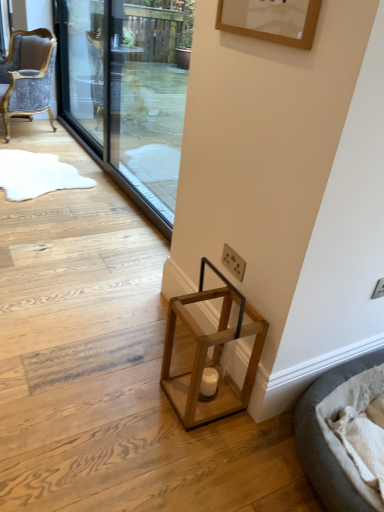
Where is `transparent glass screen door at upper left, the first screen door viewed from the left`? The image size is (384, 512). transparent glass screen door at upper left, the first screen door viewed from the left is located at coordinates (x=84, y=69).

At what (x,y) coordinates should I click in order to perform the action: click on velvet grey chair at left. Please return your answer as a coordinate pair (x, y). Image resolution: width=384 pixels, height=512 pixels. Looking at the image, I should click on pos(27,76).

From a real-world perspective, which object rests below the other?

wooden lantern at lower center.

Which of these two, wooden lantern at lower center or velvet grey chair at left, is wider?

velvet grey chair at left is wider.

Considering the relative sizes of wooden lantern at lower center and velvet grey chair at left in the image provided, is wooden lantern at lower center taller than velvet grey chair at left?

No, wooden lantern at lower center is not taller than velvet grey chair at left.

Is wooden lantern at lower center in contact with velvet grey chair at left?

No, wooden lantern at lower center is not touching velvet grey chair at left.

Based on their positions, is velvet grey chair at left located to the left or right of wooden lantern at lower center?

velvet grey chair at left is positioned on wooden lantern at lower center's left side.

In terms of height, does velvet grey chair at left look taller or shorter compared to wooden lantern at lower center?

In the image, velvet grey chair at left appears to be taller than wooden lantern at lower center.

From the image's perspective, is velvet grey chair at left above or below wooden lantern at lower center?

Clearly, from the image's perspective, velvet grey chair at left is above wooden lantern at lower center.

Between velvet grey chair at left and soft gray fabric cat bed at lower right, which one has smaller width?

With smaller width is velvet grey chair at left.

Is soft gray fabric cat bed at lower right at the back of velvet grey chair at left?

That's not correct — velvet grey chair at left is not looking away from soft gray fabric cat bed at lower right.

Is velvet grey chair at left far away from soft gray fabric cat bed at lower right?

Absolutely, velvet grey chair at left is distant from soft gray fabric cat bed at lower right.

Which is behind, velvet grey chair at left or soft gray fabric cat bed at lower right?

velvet grey chair at left is more distant.

At what (x,y) coordinates should I click in order to perform the action: click on cat bed on the right of wooden lantern at lower center. Please return your answer as a coordinate pair (x, y). The image size is (384, 512). Looking at the image, I should click on (325, 441).

Considering the points (183, 296) and (322, 399), which point is in front, point (183, 296) or point (322, 399)?

Point (322, 399)

From a real-world perspective, relative to soft gray fabric cat bed at lower right, is wooden lantern at lower center vertically above or below?

wooden lantern at lower center is below soft gray fabric cat bed at lower right.

From a real-world perspective, does velvet grey chair at left stand above transparent glass screen door at upper left, the first screen door viewed from the left?

No, from a real-world perspective, velvet grey chair at left is not on top of transparent glass screen door at upper left, the first screen door viewed from the left.

Is there a large distance between velvet grey chair at left and transparent glass screen door at upper left, which is the second screen door from right to left?

No, velvet grey chair at left is not far from transparent glass screen door at upper left, which is the second screen door from right to left.

Who is shorter, velvet grey chair at left or transparent glass screen door at upper left, the first screen door viewed from the left?

Standing shorter between the two is velvet grey chair at left.

Which is more to the left, transparent glass screen door at upper left, which is the second screen door from right to left, or velvet grey chair at left?

velvet grey chair at left is more to the left.

Can you confirm if transparent glass screen door at upper left, which is the second screen door from right to left, is bigger than velvet grey chair at left?

Incorrect, transparent glass screen door at upper left, which is the second screen door from right to left, is not larger than velvet grey chair at left.

Would you consider transparent glass screen door at upper left, the first screen door viewed from the left, to be distant from velvet grey chair at left?

Actually, transparent glass screen door at upper left, the first screen door viewed from the left, and velvet grey chair at left are a little close together.

From the image's perspective, would you say transparent glass screen door at upper center, positioned as the first screen door in right-to-left order, is positioned over transparent glass screen door at upper left, the first screen door viewed from the left?

No, from the image's perspective, transparent glass screen door at upper center, positioned as the first screen door in right-to-left order, is not on top of transparent glass screen door at upper left, the first screen door viewed from the left.

What's the angular difference between transparent glass screen door at upper center, which is counted as the 2th screen door, starting from the left, and transparent glass screen door at upper left, which is the second screen door from right to left,'s facing directions?

The angle between the facing direction of transparent glass screen door at upper center, which is counted as the 2th screen door, starting from the left, and the facing direction of transparent glass screen door at upper left, which is the second screen door from right to left, is 0.468 degrees.

Is transparent glass screen door at upper center, positioned as the first screen door in right-to-left order, at the left side of transparent glass screen door at upper left, the first screen door viewed from the left?

In fact, transparent glass screen door at upper center, positioned as the first screen door in right-to-left order, is to the right of transparent glass screen door at upper left, the first screen door viewed from the left.

Looking at this image, could transparent glass screen door at upper left, the first screen door viewed from the left, be considered to be inside transparent glass screen door at upper center, positioned as the first screen door in right-to-left order?

That's incorrect, transparent glass screen door at upper left, the first screen door viewed from the left, is not inside transparent glass screen door at upper center, positioned as the first screen door in right-to-left order.

In the image, there is a wooden lantern at lower center. Where is `chair above it (from the image's perspective)`? This screenshot has width=384, height=512. chair above it (from the image's perspective) is located at coordinates (27, 76).

This screenshot has width=384, height=512. I want to click on stool below the velvet grey chair at left (from a real-world perspective), so click(209, 359).

Which object lies nearer to the anchor point wooden lantern at lower center, velvet grey chair at left or transparent glass screen door at upper center, which is counted as the 2th screen door, starting from the left?

Based on the image, transparent glass screen door at upper center, which is counted as the 2th screen door, starting from the left, appears to be nearer to wooden lantern at lower center.

Considering their positions, is velvet grey chair at left positioned further to transparent glass screen door at upper left, which is the second screen door from right to left, than wooden lantern at lower center?

Among the two, wooden lantern at lower center is located further to transparent glass screen door at upper left, which is the second screen door from right to left.

When comparing their distances from velvet grey chair at left, does soft gray fabric cat bed at lower right or transparent glass screen door at upper left, the first screen door viewed from the left, seem further?

Among the two, soft gray fabric cat bed at lower right is located further to velvet grey chair at left.

Looking at the image, which one is located closer to velvet grey chair at left, wooden lantern at lower center or transparent glass screen door at upper center, positioned as the first screen door in right-to-left order?

transparent glass screen door at upper center, positioned as the first screen door in right-to-left order, lies closer to velvet grey chair at left than the other object.

From the image, which object appears to be nearer to transparent glass screen door at upper left, which is the second screen door from right to left, soft gray fabric cat bed at lower right or wooden lantern at lower center?

wooden lantern at lower center.

Considering their positions, is velvet grey chair at left positioned closer to wooden lantern at lower center than transparent glass screen door at upper left, the first screen door viewed from the left?

Based on the image, transparent glass screen door at upper left, the first screen door viewed from the left, appears to be nearer to wooden lantern at lower center.

When comparing their distances from velvet grey chair at left, does soft gray fabric cat bed at lower right or wooden lantern at lower center seem further?

Based on the image, soft gray fabric cat bed at lower right appears to be further to velvet grey chair at left.

Estimate the real-world distances between objects in this image. Which object is closer to transparent glass screen door at upper center, positioned as the first screen door in right-to-left order, soft gray fabric cat bed at lower right or wooden lantern at lower center?

Among the two, wooden lantern at lower center is located nearer to transparent glass screen door at upper center, positioned as the first screen door in right-to-left order.

Locate an element on the screen. Image resolution: width=384 pixels, height=512 pixels. stool between transparent glass screen door at upper left, which is the second screen door from right to left, and soft gray fabric cat bed at lower right, in the vertical direction is located at coordinates (209, 359).

Locate an element on the screen. chair between transparent glass screen door at upper left, which is the second screen door from right to left, and wooden lantern at lower center, in the vertical direction is located at coordinates pyautogui.click(x=27, y=76).

You are a GUI agent. You are given a task and a screenshot of the screen. Output one action in this format:
    pyautogui.click(x=<x>, y=<y>)
    Task: Click on the screen door between transparent glass screen door at upper left, which is the second screen door from right to left, and wooden lantern at lower center vertically
    
    Given the screenshot: What is the action you would take?
    pyautogui.click(x=128, y=91)

This screenshot has height=512, width=384. Find the location of `screen door between transparent glass screen door at upper center, which is counted as the 2th screen door, starting from the left, and velvet grey chair at left, along the z-axis`. screen door between transparent glass screen door at upper center, which is counted as the 2th screen door, starting from the left, and velvet grey chair at left, along the z-axis is located at coordinates (84, 69).